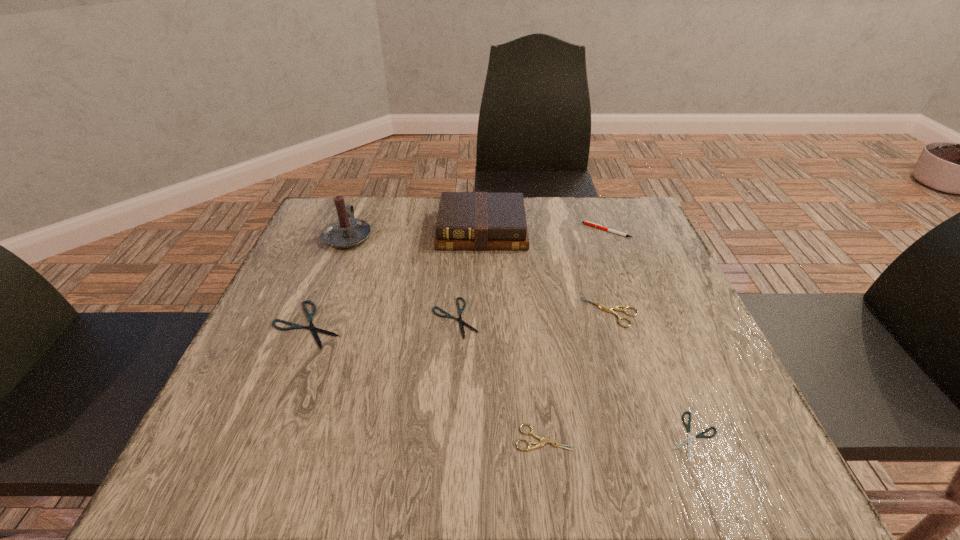
You are a GUI agent. You are given a task and a screenshot of the screen. Output one action in this format:
    pyautogui.click(x=<x>, y=<y>)
    Task: Click on the candle
    The height and width of the screenshot is (540, 960).
    Given the screenshot: What is the action you would take?
    pyautogui.click(x=345, y=232)

Where is `Bible`? Bible is located at coordinates (x=466, y=220).

Where is `pen`? pen is located at coordinates (585, 222).

At what (x,y) coordinates should I click in order to perform the action: click on white pen. Please return your answer as a coordinate pair (x, y). The height and width of the screenshot is (540, 960). Looking at the image, I should click on (585, 222).

Locate an element on the screen. Image resolution: width=960 pixels, height=540 pixels. the right beige shears is located at coordinates (616, 307).

At what (x,y) coordinates should I click in order to perform the action: click on the fifth shortest object. Please return your answer as a coordinate pair (x, y). Looking at the image, I should click on (616, 307).

Locate an element on the screen. Image resolution: width=960 pixels, height=540 pixels. the leftmost shears is located at coordinates (311, 327).

Find the location of a particular element. the biggest black shears is located at coordinates (311, 327).

Locate an element on the screen. The height and width of the screenshot is (540, 960). the nearer beige shears is located at coordinates (543, 441).

Locate an element on the screen. The height and width of the screenshot is (540, 960). the smaller beige shears is located at coordinates (543, 441).